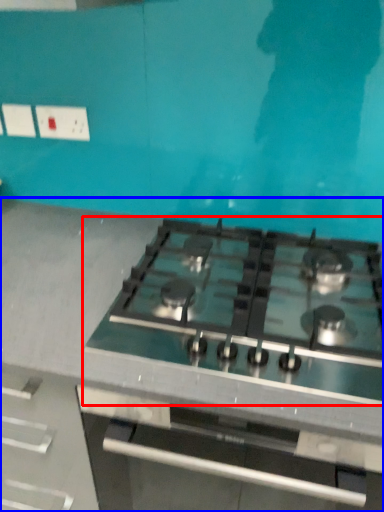
Question: Which object is closer to the camera taking this photo, gas stove (highlighted by a red box) or countertop (highlighted by a blue box)?

Choices:
 (A) gas stove
 (B) countertop

Answer: (B)